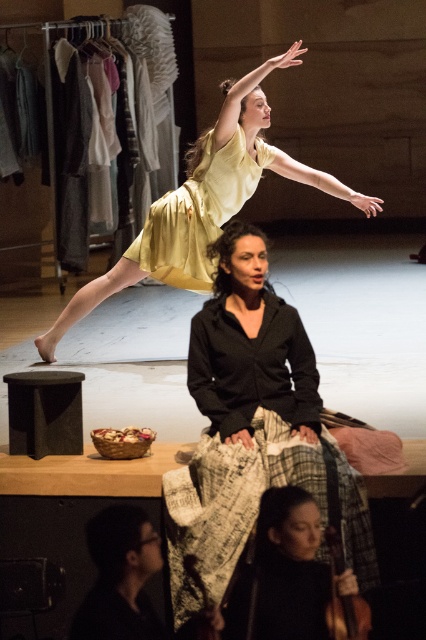
Question: Is black textured skirt at center below black textured jacket at center?

Choices:
 (A) no
 (B) yes

Answer: (B)

Question: Which point is closer to the camera?

Choices:
 (A) (222, 413)
 (B) (247, 316)
 (C) (123, 557)

Answer: (A)

Question: Which point is farther to the camera?

Choices:
 (A) (242, 314)
 (B) (284, 404)
 (C) (163, 253)
 (D) (149, 211)

Answer: (D)

Question: Does matte yellow dress at upper center appear under black wool sweater at center?

Choices:
 (A) no
 (B) yes

Answer: (A)

Question: Is black textured skirt at center to the right of black textured jacket at center from the viewer's perspective?

Choices:
 (A) yes
 (B) no

Answer: (A)

Question: Which point is closer to the camera taking this photo?

Choices:
 (A) (271, 323)
 (B) (129, 509)
 (C) (218, 193)

Answer: (B)